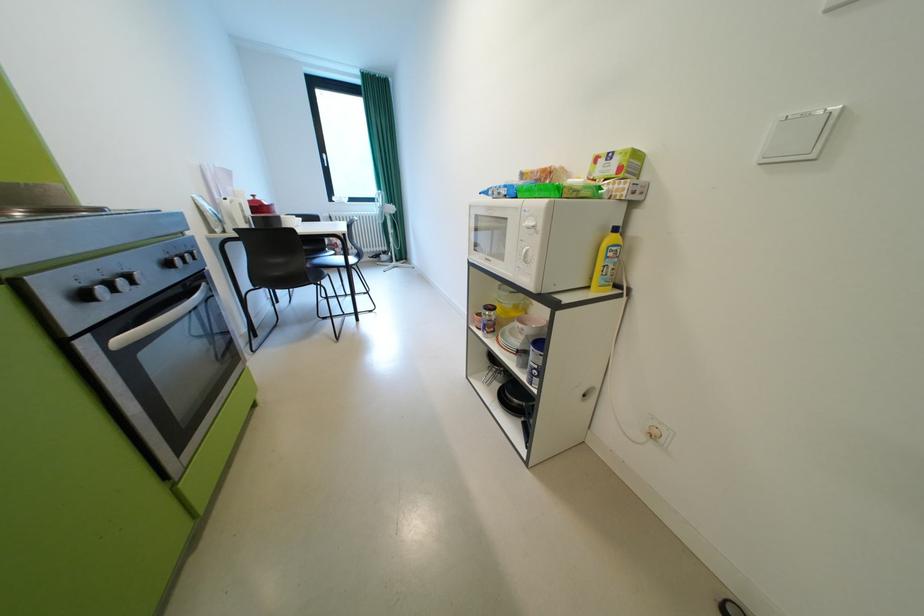
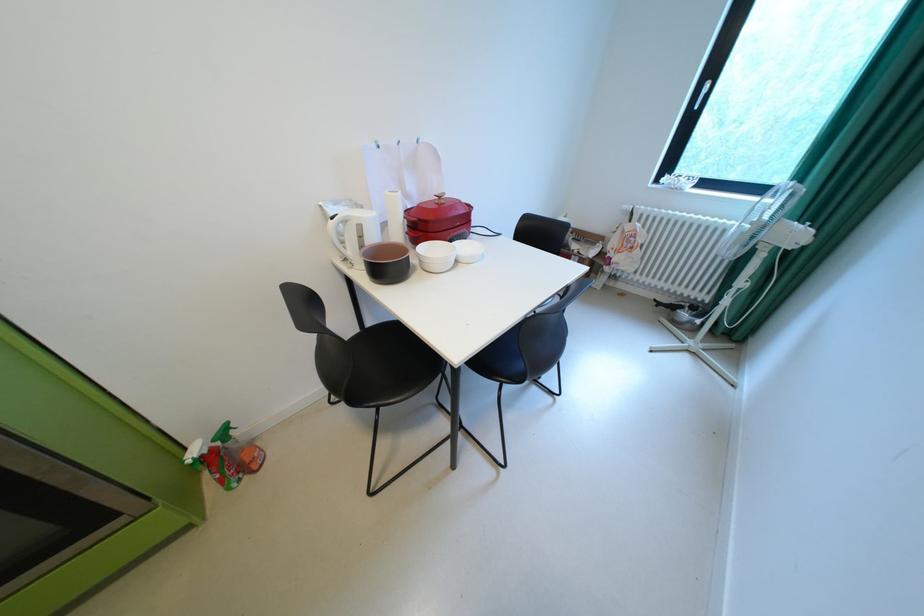
Find the pixel in the second image that matches (x=263, y=197) in the first image.

(450, 198)